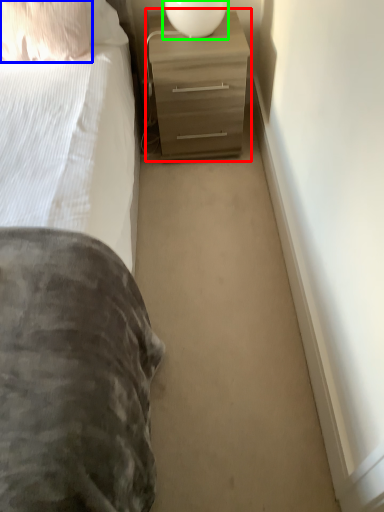
Question: Which object is positioned closest to chest of drawers (highlighted by a red box)? Select from pillow (highlighted by a blue box) and table lamp (highlighted by a green box).

Choices:
 (A) pillow
 (B) table lamp

Answer: (B)